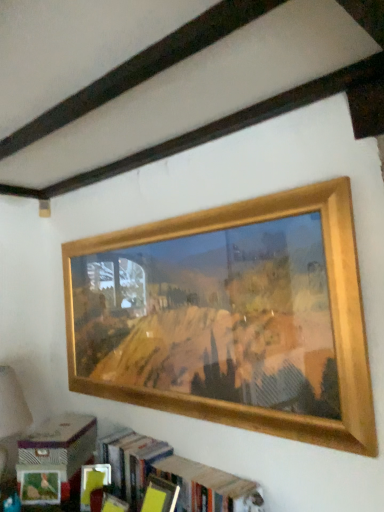
Question: Is matte cardboard box at lower left to the right of wooden picture frame at upper center from the viewer's perspective?

Choices:
 (A) no
 (B) yes

Answer: (A)

Question: Considering the relative sizes of matte cardboard box at lower left and wooden picture frame at upper center in the image provided, is matte cardboard box at lower left smaller than wooden picture frame at upper center?

Choices:
 (A) yes
 (B) no

Answer: (A)

Question: From a real-world perspective, is matte cardboard box at lower left under wooden picture frame at upper center?

Choices:
 (A) no
 (B) yes

Answer: (B)

Question: Is matte cardboard box at lower left far from wooden picture frame at upper center?

Choices:
 (A) no
 (B) yes

Answer: (A)

Question: Is matte cardboard box at lower left next to wooden picture frame at upper center?

Choices:
 (A) yes
 (B) no

Answer: (B)

Question: From the image's perspective, is wooden bookshelf at lower center positioned above or below wooden picture frame at upper center?

Choices:
 (A) below
 (B) above

Answer: (A)

Question: Would you say wooden bookshelf at lower center is inside or outside wooden picture frame at upper center?

Choices:
 (A) outside
 (B) inside

Answer: (A)

Question: Does point (157, 468) appear closer or farther from the camera than point (360, 295)?

Choices:
 (A) farther
 (B) closer

Answer: (A)

Question: Based on their sizes in the image, would you say wooden bookshelf at lower center is bigger or smaller than wooden picture frame at upper center?

Choices:
 (A) big
 (B) small

Answer: (B)

Question: Would you say wooden picture frame at upper center is to the left or to the right of wooden bookshelf at lower center in the picture?

Choices:
 (A) right
 (B) left

Answer: (B)

Question: Is point (279, 431) positioned closer to the camera than point (158, 456)?

Choices:
 (A) closer
 (B) farther

Answer: (A)

Question: Is wooden picture frame at upper center spatially inside wooden bookshelf at lower center, or outside of it?

Choices:
 (A) inside
 (B) outside

Answer: (B)

Question: In the image, is wooden picture frame at upper center positioned in front of or behind wooden bookshelf at lower center?

Choices:
 (A) behind
 (B) front

Answer: (B)

Question: From their relative heights in the image, would you say matte cardboard box at lower left is taller or shorter than wooden bookshelf at lower center?

Choices:
 (A) tall
 (B) short

Answer: (B)

Question: Is matte cardboard box at lower left inside the boundaries of wooden bookshelf at lower center, or outside?

Choices:
 (A) inside
 (B) outside

Answer: (B)